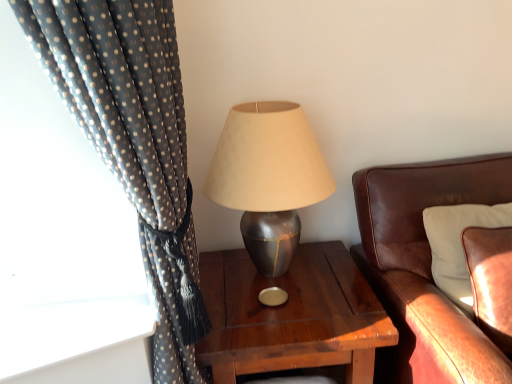
Question: Is leather cushion at right wider or thinner than metallic gray lamp at center?

Choices:
 (A) wide
 (B) thin

Answer: (B)

Question: From a real-world perspective, is leather cushion at right positioned above or below metallic gray lamp at center?

Choices:
 (A) above
 (B) below

Answer: (B)

Question: Estimate the real-world distances between objects in this image. Which object is farther from the leather cushion at right?

Choices:
 (A) wooden nightstand at center
 (B) brown leather couch at right
 (C) metallic gray lamp at center
 (D) polka dot fabric curtain at left

Answer: (D)

Question: Which object is positioned closest to the wooden nightstand at center?

Choices:
 (A) metallic gray lamp at center
 (B) brown leather couch at right
 (C) polka dot fabric curtain at left
 (D) leather cushion at right

Answer: (A)